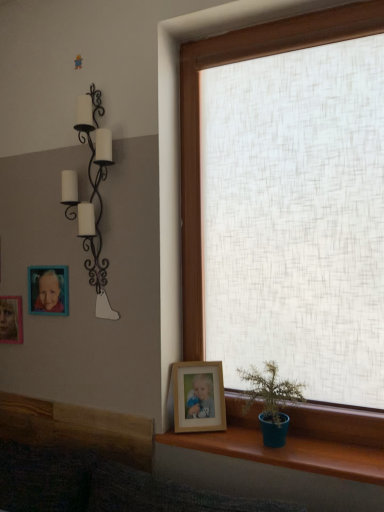
Identify the location of vacant area that lies between wooden photo frame at lower center, which is counted as the first picture frame, starting from the front, and teal ceramic pot at lower right. (212, 436).